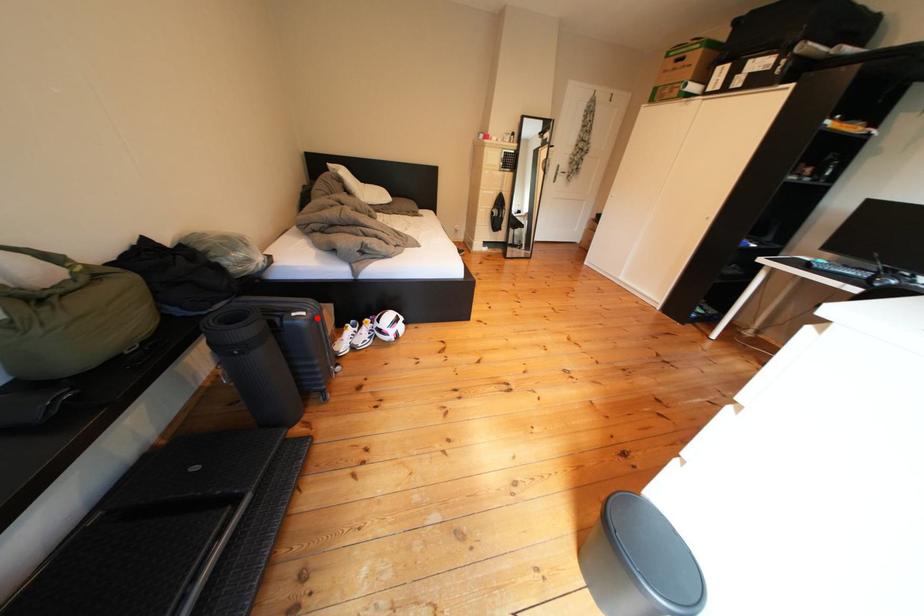
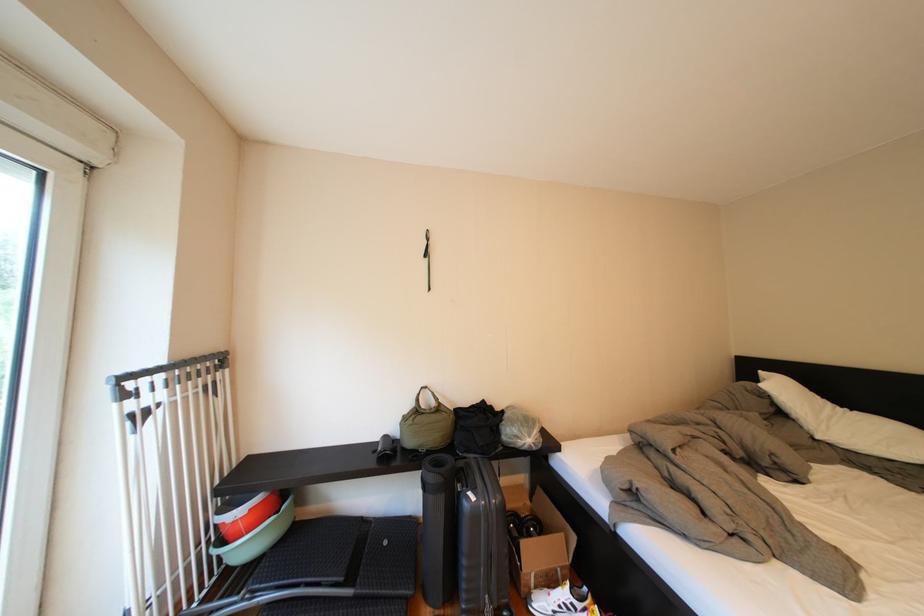
Locate, in the second image, the point that corresponds to the highlighted location in the first image.

(487, 503)